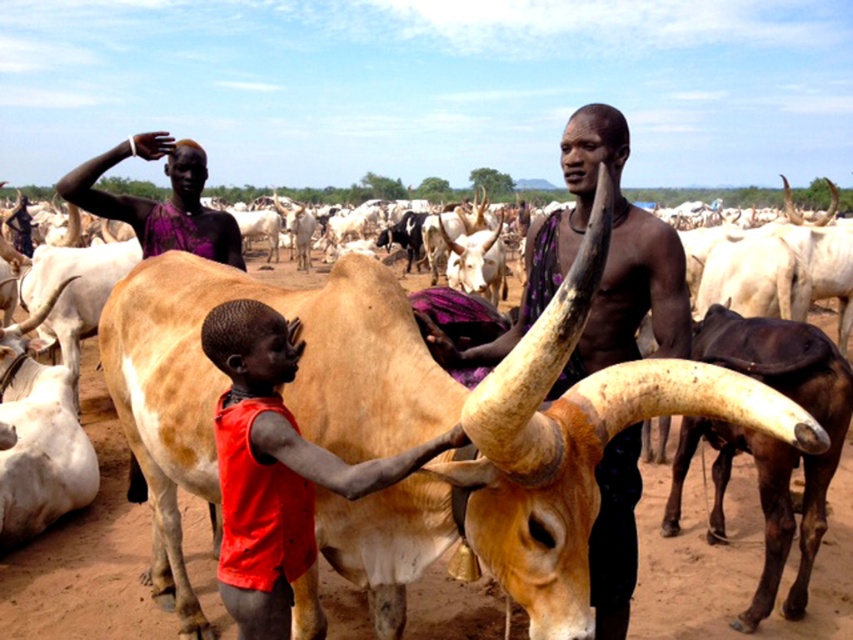
You are a photographer trying to capture the scene of the boy and the cow. You notice a point in the image at coordinates (604, 268). What object is located at that point?

The point at coordinates (604, 268) marks the matte purple shirt at center.

You are a photographer trying to capture the boy in the red sleeveless shirt at center and the purple fabric at upper center in a single frame. Based on their sizes, which object would appear bigger in your photo?

The red sleeveless shirt at center appears bigger in the photo since it has a larger size compared to the purple fabric at upper center.